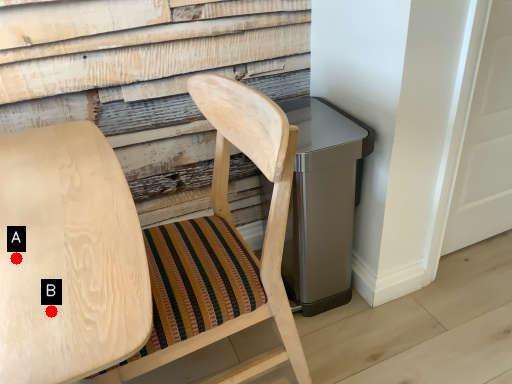
Question: Two points are circled on the image, labeled by A and B beside each circle. Which point is farther to the camera?

Choices:
 (A) A is further
 (B) B is further

Answer: (A)